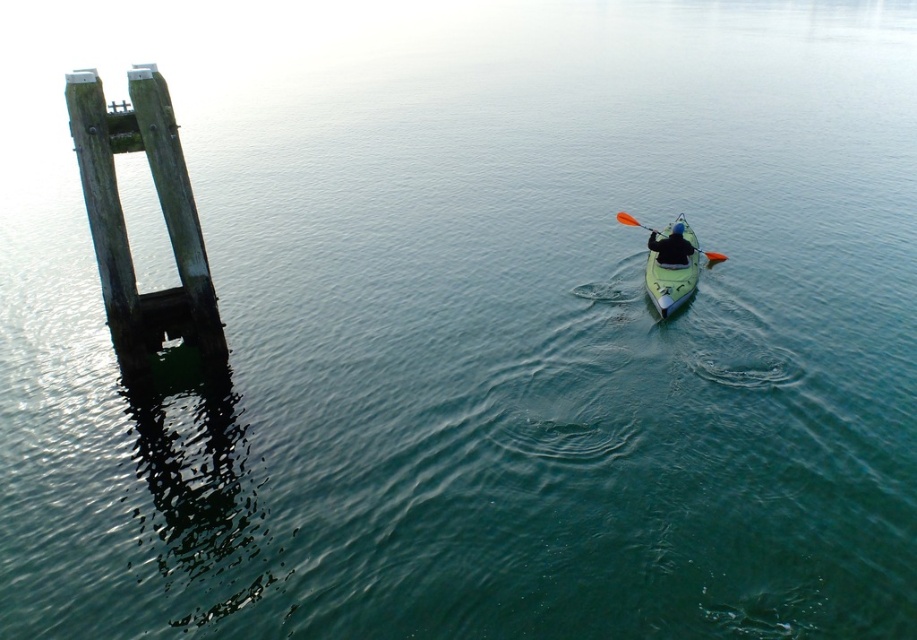
This screenshot has width=917, height=640. Find the location of `yellow-green plastic kayak at right`. yellow-green plastic kayak at right is located at coordinates (671, 268).

What do you see at coordinates (671, 268) in the screenshot? I see `yellow-green plastic kayak at right` at bounding box center [671, 268].

The width and height of the screenshot is (917, 640). Identify the location of yellow-green plastic kayak at right. (671, 268).

Who is more forward, (x=208, y=342) or (x=657, y=296)?

Positioned in front is point (x=208, y=342).

Can you confirm if weathered wood dock at left is positioned to the right of yellow-green plastic kayak at right?

Incorrect, weathered wood dock at left is not on the right side of yellow-green plastic kayak at right.

Consider the image. Who is more forward, (195, 221) or (668, 282)?

Point (195, 221) is in front.

In order to click on weathered wood dock at left in this screenshot , I will do `click(124, 224)`.

The height and width of the screenshot is (640, 917). Describe the element at coordinates (671, 248) in the screenshot. I see `matte green kayak at right` at that location.

This screenshot has width=917, height=640. Find the location of `matte green kayak at right`. matte green kayak at right is located at coordinates (671, 248).